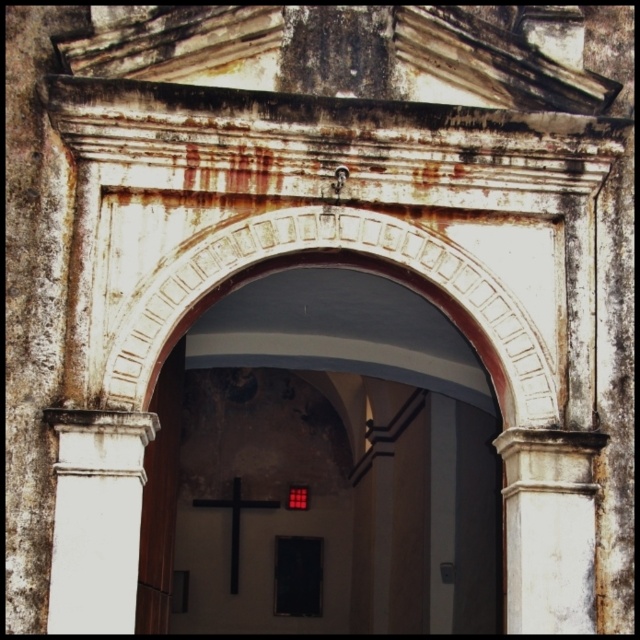
Is white smooth column at left smaller than white stone column at right?

No.

Between point (77, 464) and point (506, 460), which one is positioned behind?

The point (506, 460) is more distant.

You are a GUI agent. You are given a task and a screenshot of the screen. Output one action in this format:
    pyautogui.click(x=<x>, y=<y>)
    Task: Click on the white smooth column at left
    The width and height of the screenshot is (640, 640).
    Given the screenshot: What is the action you would take?
    pyautogui.click(x=97, y=518)